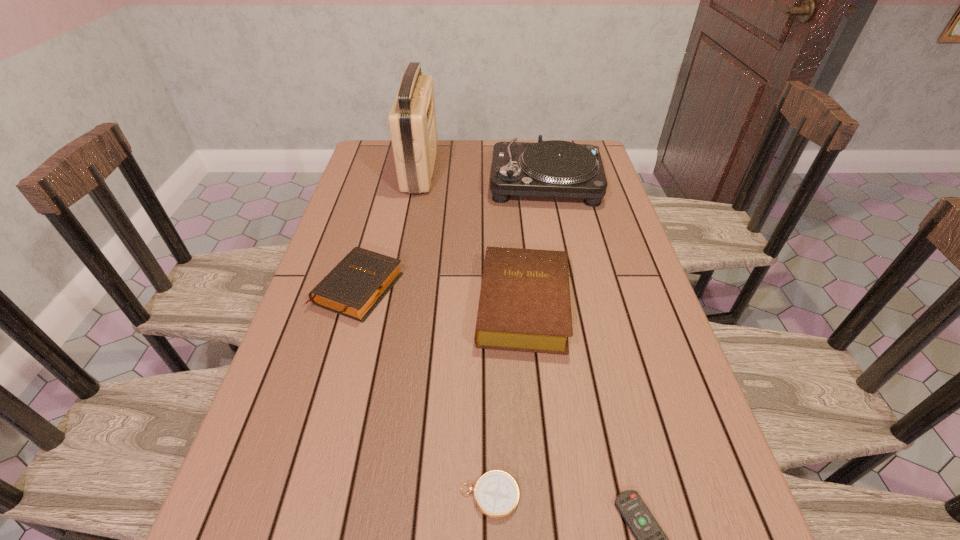
In order to click on free space located 0.230m on the back of the shorter Bible in this screenshot , I will do `click(380, 208)`.

You are a GUI agent. You are given a task and a screenshot of the screen. Output one action in this format:
    pyautogui.click(x=<x>, y=<y>)
    Task: Click on the vacant space located 0.210m on the back of the second shortest object
    
    Given the screenshot: What is the action you would take?
    pyautogui.click(x=488, y=373)

You are a GUI agent. You are given a task and a screenshot of the screen. Output one action in this format:
    pyautogui.click(x=<x>, y=<y>)
    Task: Click on the radio receiver present at the far edge
    This screenshot has height=540, width=960.
    Given the screenshot: What is the action you would take?
    pyautogui.click(x=412, y=120)

The image size is (960, 540). I want to click on record player located in the far edge section of the desktop, so click(554, 168).

I want to click on radio receiver present at the left edge, so click(x=412, y=120).

You are a GUI agent. You are given a task and a screenshot of the screen. Output one action in this format:
    pyautogui.click(x=<x>, y=<y>)
    Task: Click on the Bible that is at the left edge
    The height and width of the screenshot is (540, 960).
    Given the screenshot: What is the action you would take?
    click(359, 282)

I want to click on object present at the right edge, so click(554, 168).

Identify the location of object that is at the far left corner. The image size is (960, 540). (412, 120).

In order to click on object at the far right corner in this screenshot , I will do click(x=554, y=168).

This screenshot has width=960, height=540. I want to click on free space at the far edge of the desktop, so click(508, 139).